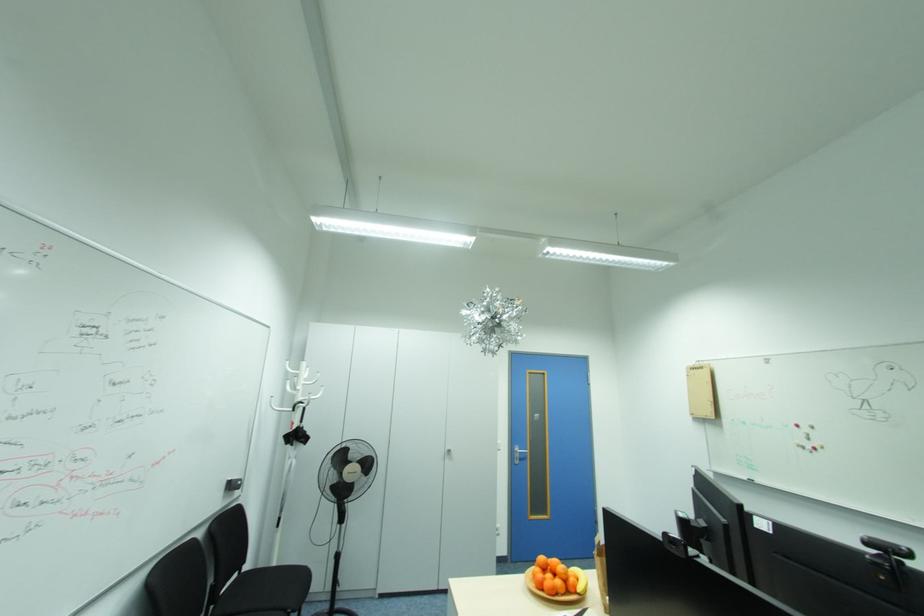
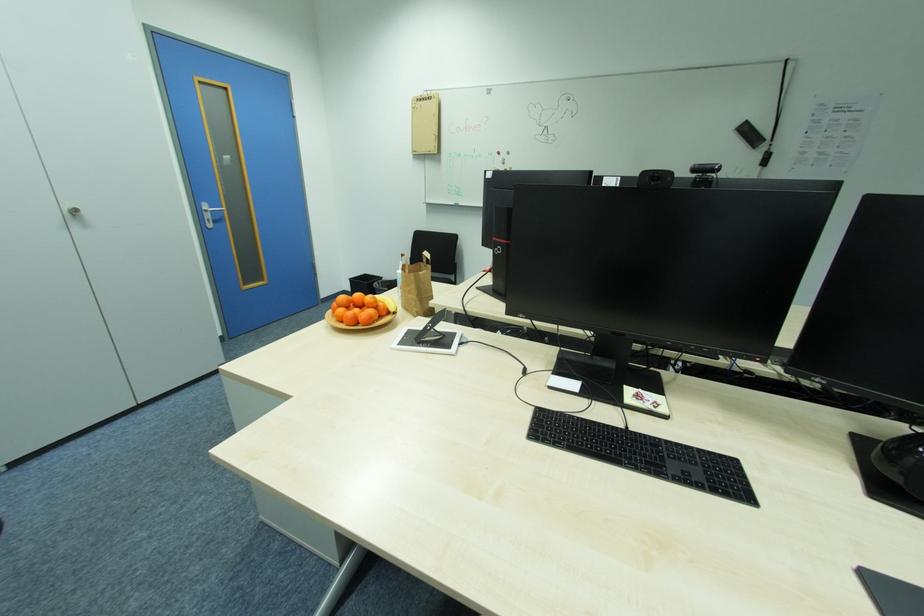
How did the camera likely rotate?

The camera's rotation is toward right-down.